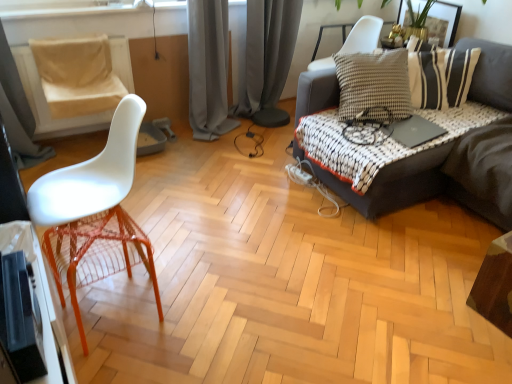
Question: Is black matte laptop at upper right far from beige fabric swivel chair at left?

Choices:
 (A) yes
 (B) no

Answer: (A)

Question: Does black matte laptop at upper right have a smaller size compared to beige fabric swivel chair at left?

Choices:
 (A) yes
 (B) no

Answer: (A)

Question: Does black matte laptop at upper right have a lesser width compared to beige fabric swivel chair at left?

Choices:
 (A) yes
 (B) no

Answer: (B)

Question: From a real-world perspective, is black matte laptop at upper right over beige fabric swivel chair at left?

Choices:
 (A) no
 (B) yes

Answer: (B)

Question: From the image's perspective, would you say black matte laptop at upper right is shown under beige fabric swivel chair at left?

Choices:
 (A) yes
 (B) no

Answer: (A)

Question: Looking at their shapes, would you say gold metallic picture frame at upper right is wider or thinner than dark gray fabric couch at right?

Choices:
 (A) thin
 (B) wide

Answer: (A)

Question: From their relative heights in the image, would you say gold metallic picture frame at upper right is taller or shorter than dark gray fabric couch at right?

Choices:
 (A) tall
 (B) short

Answer: (B)

Question: From the image's perspective, is gold metallic picture frame at upper right located above or below dark gray fabric couch at right?

Choices:
 (A) below
 (B) above

Answer: (B)

Question: Would you say gold metallic picture frame at upper right is to the left or to the right of dark gray fabric couch at right in the picture?

Choices:
 (A) right
 (B) left

Answer: (A)

Question: Do you think gray velvet curtain at center, the 2th curtain from the left, is within dark gray fabric couch at right, or outside of it?

Choices:
 (A) outside
 (B) inside

Answer: (A)

Question: Considering the relative positions of gray velvet curtain at center, the 2th curtain from the left, and dark gray fabric couch at right in the image provided, is gray velvet curtain at center, the 2th curtain from the left, to the left or to the right of dark gray fabric couch at right?

Choices:
 (A) left
 (B) right

Answer: (A)

Question: From a real-world perspective, is gray velvet curtain at center, the 2th curtain from the left, positioned above or below dark gray fabric couch at right?

Choices:
 (A) above
 (B) below

Answer: (A)

Question: From their relative heights in the image, would you say gray velvet curtain at center, the first curtain from the right, is taller or shorter than dark gray fabric couch at right?

Choices:
 (A) short
 (B) tall

Answer: (B)

Question: Considering the positions of point (128, 87) and point (412, 195), is point (128, 87) closer or farther from the camera than point (412, 195)?

Choices:
 (A) closer
 (B) farther

Answer: (B)

Question: Visually, is beige fabric swivel chair at left positioned to the left or to the right of dark gray fabric couch at right?

Choices:
 (A) right
 (B) left

Answer: (B)